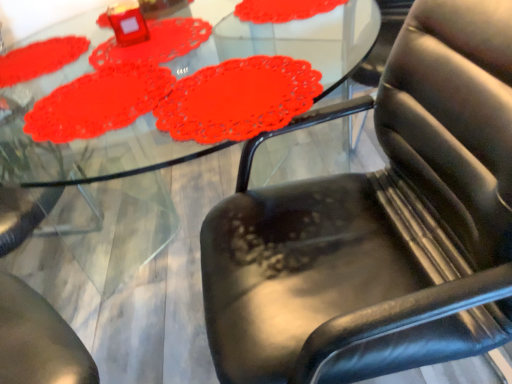
What do you see at coordinates (155, 43) in the screenshot?
I see `matte red doily at upper center, the 2th mat viewed from the back` at bounding box center [155, 43].

Looking at this image, what is the approximate width of black leather chair at lower right?

The width of black leather chair at lower right is 29.28 inches.

Identify the location of matte red doily at upper left, which is the 1th mat from back to front. This screenshot has height=384, width=512. (40, 58).

From the image's perspective, is black leather chair at lower right below matte red doily at upper center, the 2th mat viewed from the back?

Yes, from the image's perspective, black leather chair at lower right is beneath matte red doily at upper center, the 2th mat viewed from the back.

Based on the photo, considering the relative sizes of black leather chair at lower right and matte red doily at upper center, the 2th mat viewed from the back, in the image provided, is black leather chair at lower right wider than matte red doily at upper center, the 2th mat viewed from the back,?

Yes.

Which is closer, (447, 231) or (99, 66)?

Point (447, 231)

From a real-world perspective, between black leather chair at lower right and matte red doily at upper center, the 2th mat viewed from the back, who is vertically higher?

matte red doily at upper center, the 2th mat viewed from the back.

Which of these two, matte red doily at upper left, the third mat from the back, or matte red doily at upper center, the 2th mat viewed from the back, is bigger?

matte red doily at upper center, the 2th mat viewed from the back, is bigger.

Consider the image. Is matte red doily at upper left, placed as the 1th mat when sorted from front to back, outside of matte red doily at upper center, which is the second mat from front to back?

Indeed, matte red doily at upper left, placed as the 1th mat when sorted from front to back, is completely outside matte red doily at upper center, which is the second mat from front to back.

Could you tell me if matte red doily at upper left, the third mat from the back, is turned towards matte red doily at upper center, the 2th mat viewed from the back?

No.

Looking at this image, is matte red doily at upper left, the third mat from the back, wider or thinner than black leather chair at lower right?

matte red doily at upper left, the third mat from the back, is thinner than black leather chair at lower right.

Between matte red doily at upper left, the third mat from the back, and black leather chair at lower right, which one appears on the left side from the viewer's perspective?

matte red doily at upper left, the third mat from the back, is more to the left.

Which object is closer to the camera, matte red doily at upper left, placed as the 1th mat when sorted from front to back, or black leather chair at lower right?

Positioned in front is black leather chair at lower right.

From a real-world perspective, is matte red doily at upper left, placed as the 1th mat when sorted from front to back, above or below black leather chair at lower right?

Clearly, from a real-world perspective, matte red doily at upper left, placed as the 1th mat when sorted from front to back, is above black leather chair at lower right.

Which is more to the left, matte red doily at upper left, which is the 3th mat from front to back, or matte red doily at upper left, placed as the 1th mat when sorted from front to back?

matte red doily at upper left, which is the 3th mat from front to back.

Who is smaller, matte red doily at upper left, which is the 1th mat from back to front, or matte red doily at upper left, placed as the 1th mat when sorted from front to back?

matte red doily at upper left, which is the 1th mat from back to front, is smaller.

Based on the photo, is matte red doily at upper left, which is the 1th mat from back to front, thinner than matte red doily at upper left, placed as the 1th mat when sorted from front to back?

Yes, matte red doily at upper left, which is the 1th mat from back to front, is thinner than matte red doily at upper left, placed as the 1th mat when sorted from front to back.

Is matte red doily at upper left, which is the 1th mat from back to front, inside the boundaries of matte red doily at upper left, placed as the 1th mat when sorted from front to back, or outside?

matte red doily at upper left, which is the 1th mat from back to front, is located beyond the bounds of matte red doily at upper left, placed as the 1th mat when sorted from front to back.

Is matte red doily at upper left, which is the 3th mat from front to back, in front of or behind black leather chair at lower right in the image?

Visually, matte red doily at upper left, which is the 3th mat from front to back, is located behind black leather chair at lower right.

Would you consider matte red doily at upper left, which is the 3th mat from front to back, to be distant from black leather chair at lower right?

Indeed, matte red doily at upper left, which is the 3th mat from front to back, is not near black leather chair at lower right.

Can you confirm if matte red doily at upper left, which is the 1th mat from back to front, is taller than black leather chair at lower right?

In fact, matte red doily at upper left, which is the 1th mat from back to front, may be shorter than black leather chair at lower right.

Is matte red doily at upper left, which is the 1th mat from back to front, facing away from black leather chair at lower right?

No, black leather chair at lower right is not at the back of matte red doily at upper left, which is the 1th mat from back to front.

Is point (8, 55) behind point (101, 64)?

Yes, point (8, 55) is behind point (101, 64).

In the scene shown: Can we say matte red doily at upper left, which is the 1th mat from back to front, lies outside matte red doily at upper center, which is the second mat from front to back?

Yes.

Does matte red doily at upper left, which is the 1th mat from back to front, come behind matte red doily at upper center, which is the second mat from front to back?

Yes.

From a real-world perspective, is matte red doily at upper left, which is the 3th mat from front to back, located higher than matte red doily at upper center, which is the second mat from front to back?

Yes.

From a real-world perspective, relative to matte red doily at upper left, which is the 3th mat from front to back, is matte red doily at upper left, the third mat from the back, vertically above or below?

In terms of real-world spatial position, matte red doily at upper left, the third mat from the back, is below matte red doily at upper left, which is the 3th mat from front to back.

In terms of width, does matte red doily at upper left, the third mat from the back, look wider or thinner when compared to matte red doily at upper left, which is the 3th mat from front to back?

matte red doily at upper left, the third mat from the back, is wider than matte red doily at upper left, which is the 3th mat from front to back.

Is matte red doily at upper left, placed as the 1th mat when sorted from front to back, located outside matte red doily at upper left, which is the 1th mat from back to front?

Indeed, matte red doily at upper left, placed as the 1th mat when sorted from front to back, is completely outside matte red doily at upper left, which is the 1th mat from back to front.

Is matte red doily at upper left, the third mat from the back, not near matte red doily at upper left, which is the 1th mat from back to front?

No, there isn't a large distance between matte red doily at upper left, the third mat from the back, and matte red doily at upper left, which is the 1th mat from back to front.

Where is `chair lying on the right of matte red doily at upper center, which is the second mat from front to back`? The height and width of the screenshot is (384, 512). chair lying on the right of matte red doily at upper center, which is the second mat from front to back is located at coordinates (379, 224).

From the matte red doily at upper left, the third mat from the back, count 1st mats backward and point to it. Please provide its 2D coordinates.

[(155, 43)]

From the image, which object appears to be nearer to matte red doily at upper left, which is the 1th mat from back to front, matte red doily at upper left, placed as the 1th mat when sorted from front to back, or matte red doily at upper center, the 2th mat viewed from the back?

Based on the image, matte red doily at upper center, the 2th mat viewed from the back, appears to be nearer to matte red doily at upper left, which is the 1th mat from back to front.

Estimate the real-world distances between objects in this image. Which object is closer to matte red doily at upper center, which is the second mat from front to back, black leather chair at lower right or matte red doily at upper left, which is the 1th mat from back to front?

The object closer to matte red doily at upper center, which is the second mat from front to back, is matte red doily at upper left, which is the 1th mat from back to front.

Considering their positions, is matte red doily at upper center, the 2th mat viewed from the back, positioned further to matte red doily at upper left, placed as the 1th mat when sorted from front to back, than black leather chair at lower right?

Among the two, black leather chair at lower right is located further to matte red doily at upper left, placed as the 1th mat when sorted from front to back.

Estimate the real-world distances between objects in this image. Which object is further from black leather chair at lower right, matte red doily at upper center, which is the second mat from front to back, or matte red doily at upper left, placed as the 1th mat when sorted from front to back?

Among the two, matte red doily at upper center, which is the second mat from front to back, is located further to black leather chair at lower right.

Based on their spatial positions, is matte red doily at upper left, which is the 1th mat from back to front, or matte red doily at upper left, the third mat from the back, closer to black leather chair at lower right?

Based on the image, matte red doily at upper left, the third mat from the back, appears to be nearer to black leather chair at lower right.

Considering their positions, is matte red doily at upper left, which is the 1th mat from back to front, positioned closer to black leather chair at lower right than matte red doily at upper center, the 2th mat viewed from the back?

matte red doily at upper center, the 2th mat viewed from the back.

Looking at the image, which one is located further to matte red doily at upper center, which is the second mat from front to back, matte red doily at upper left, the third mat from the back, or black leather chair at lower right?

black leather chair at lower right is further to matte red doily at upper center, which is the second mat from front to back.

When comparing their distances from black leather chair at lower right, does matte red doily at upper left, placed as the 1th mat when sorted from front to back, or matte red doily at upper center, which is the second mat from front to back, seem closer?

The object closer to black leather chair at lower right is matte red doily at upper left, placed as the 1th mat when sorted from front to back.

The height and width of the screenshot is (384, 512). I want to click on mat located between matte red doily at upper left, which is the 1th mat from back to front, and matte red doily at upper center, the 2th mat viewed from the back, in the left-right direction, so click(x=98, y=102).

Identify the location of mat positioned between black leather chair at lower right and matte red doily at upper center, which is the second mat from front to back, from near to far. (98, 102).